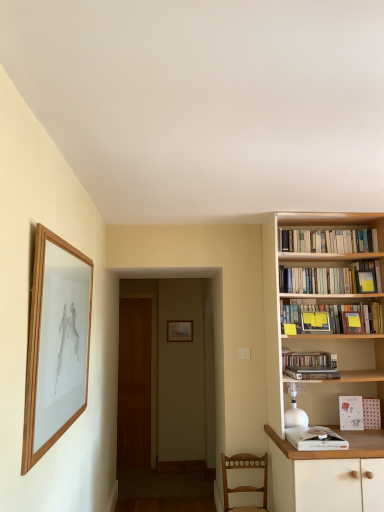
Image resolution: width=384 pixels, height=512 pixels. I want to click on wooden chair at lower right, so click(x=245, y=485).

Describe the element at coordinates (331, 279) in the screenshot. I see `hardcover books at upper right, which is counted as the second book, starting from the top` at that location.

Find the location of a particular element. brown wooden door at center is located at coordinates (134, 383).

From the picture: Is wooden bookshelf at right turned away from wooden chair at lower right?

wooden bookshelf at right does not have its back to wooden chair at lower right.

Considering the positions of objects wooden bookshelf at right and wooden chair at lower right in the image provided, who is more to the right, wooden bookshelf at right or wooden chair at lower right?

Positioned to the right is wooden bookshelf at right.

Would you say hardcover books at upper right, which is counted as the second book, starting from the top, is part of white paperbacks at upper right, the sixth book positioned from the bottom,'s contents?

No.

Considering the sizes of objects white paperbacks at upper right, which appears as the first book when viewed from the top, and hardcover books at upper right, which is counted as the second book, starting from the top, in the image provided, who is wider, white paperbacks at upper right, which appears as the first book when viewed from the top, or hardcover books at upper right, which is counted as the second book, starting from the top,?

hardcover books at upper right, which is counted as the second book, starting from the top.

Considering the positions of objects white paperbacks at upper right, the sixth book positioned from the bottom, and hardcover books at upper right, the 5th book in the bottom-to-top sequence, in the image provided, who is more to the right, white paperbacks at upper right, the sixth book positioned from the bottom, or hardcover books at upper right, the 5th book in the bottom-to-top sequence,?

white paperbacks at upper right, the sixth book positioned from the bottom.

Are white paperbacks at upper right, which appears as the first book when viewed from the top, and hardcover books at upper right, the 5th book in the bottom-to-top sequence, far apart?

Actually, white paperbacks at upper right, which appears as the first book when viewed from the top, and hardcover books at upper right, the 5th book in the bottom-to-top sequence, are a little close together.

Can you confirm if matte wooden picture frame at center, acting as the second picture frame starting from the front, is positioned to the right of wooden picture frame at left, which is counted as the first picture frame, starting from the front?

Yes.

From a real-world perspective, does matte wooden picture frame at center, acting as the second picture frame starting from the front, stand above wooden picture frame at left, acting as the second picture frame starting from the bottom?

No, from a real-world perspective, matte wooden picture frame at center, acting as the second picture frame starting from the front, is not over wooden picture frame at left, acting as the second picture frame starting from the bottom

Is matte wooden picture frame at center, which is the 2th picture frame in left-to-right order, oriented towards wooden picture frame at left, positioned as the first picture frame in top-to-bottom order?

Yes.

Is brown wooden door at center at the right side of matte wooden picture frame at center, acting as the second picture frame starting from the front?

Incorrect, brown wooden door at center is not on the right side of matte wooden picture frame at center, acting as the second picture frame starting from the front.

From the image's perspective, between brown wooden door at center and matte wooden picture frame at center, acting as the second picture frame starting from the front, which one is located above?

matte wooden picture frame at center, acting as the second picture frame starting from the front.

Which is less distant, (138, 415) or (186, 336)?

Positioned in front is point (138, 415).

From a real-world perspective, who is located higher, brown wooden door at center or matte wooden picture frame at center, placed as the 1th picture frame when sorted from back to front?

matte wooden picture frame at center, placed as the 1th picture frame when sorted from back to front, from a real-world perspective.

Can you tell me how much wooden chair at lower right and hardcover book at upper right, marked as the 3th book in a top-to-bottom arrangement, differ in facing direction?

0.0017 degrees separate the facing orientations of wooden chair at lower right and hardcover book at upper right, marked as the 3th book in a top-to-bottom arrangement.

Is wooden chair at lower right facing towards hardcover book at upper right, marked as the 3th book in a top-to-bottom arrangement?

No, wooden chair at lower right is not oriented towards hardcover book at upper right, marked as the 3th book in a top-to-bottom arrangement.

From the image's perspective, between wooden chair at lower right and hardcover book at upper right, which is the fourth book from bottom to top, which one is located above?

hardcover book at upper right, which is the fourth book from bottom to top, is shown above in the image.

Considering the relative positions of wooden chair at lower right and hardcover book at upper right, which is the fourth book from bottom to top, in the image provided, is wooden chair at lower right to the left of hardcover book at upper right, which is the fourth book from bottom to top, from the viewer's perspective?

Yes, wooden chair at lower right is to the left of hardcover book at upper right, which is the fourth book from bottom to top.

Is wooden picture frame at left, marked as the 2th picture frame in a right-to-left arrangement, looking in the opposite direction of wooden bookshelf at right?

No.

Is the depth of wooden picture frame at left, acting as the second picture frame starting from the bottom, greater than that of wooden bookshelf at right?

No, wooden picture frame at left, acting as the second picture frame starting from the bottom, is closer to the viewer.

From a real-world perspective, which is physically above, wooden picture frame at left, acting as the 2th picture frame starting from the back, or wooden bookshelf at right?

wooden bookshelf at right, from a real-world perspective.

How distant is wooden picture frame at left, acting as the second picture frame starting from the bottom, from wooden bookshelf at right?

A distance of 1.53 meters exists between wooden picture frame at left, acting as the second picture frame starting from the bottom, and wooden bookshelf at right.

Which object is thinner, hardcover books at upper right, which is counted as the second book, starting from the top, or white paper book at lower right, which is counted as the first book, starting from the bottom?

Thinner between the two is hardcover books at upper right, which is counted as the second book, starting from the top.

From the image's perspective, between hardcover books at upper right, which is counted as the second book, starting from the top, and white paper book at lower right, which is the sixth book in top-to-bottom order, who is located below?

white paper book at lower right, which is the sixth book in top-to-bottom order, from the image's perspective.

Between hardcover books at upper right, the 5th book in the bottom-to-top sequence, and white paper book at lower right, which is counted as the first book, starting from the bottom, which one appears on the right side from the viewer's perspective?

hardcover books at upper right, the 5th book in the bottom-to-top sequence, is more to the right.

Between point (326, 281) and point (317, 433), which one is positioned in front?

The point (317, 433) is closer.

You are a GUI agent. You are given a task and a screenshot of the screen. Output one action in this format:
    pyautogui.click(x=<x>, y=<y>)
    Task: Click on the chair located in front of the wooden bookshelf at right
    This screenshot has height=512, width=384.
    Given the screenshot: What is the action you would take?
    pyautogui.click(x=245, y=485)

Find the location of a particular element. The image size is (384, 512). the 2nd book to the left of the white paperbacks at upper right, the sixth book positioned from the bottom, starting your count from the anchor is located at coordinates (331, 279).

From the image, which object appears to be farther from white paperbacks at upper right, the sixth book positioned from the bottom, wooden bookshelf at right or white paper book at lower right, which is counted as the first book, starting from the bottom?

Based on the image, white paper book at lower right, which is counted as the first book, starting from the bottom, appears to be further to white paperbacks at upper right, the sixth book positioned from the bottom.

From the image, which object appears to be farther from wooden picture frame at left, the first picture frame in the left-to-right sequence, hardcover books at upper right, which is counted as the second book, starting from the top, or brown wooden door at center?

brown wooden door at center lies further to wooden picture frame at left, the first picture frame in the left-to-right sequence, than the other object.

When comparing their distances from white paperbacks at upper right, the sixth book positioned from the bottom, does wooden chair at lower right or matte wooden picture frame at center, the second picture frame from the top, seem closer?

wooden chair at lower right.

When comparing their distances from wooden picture frame at left, positioned as the first picture frame in top-to-bottom order, does hardcover books at right, positioned as the 4th book in top-to-bottom order, or hardcover books at upper right, the 5th book in the bottom-to-top sequence, seem closer?

hardcover books at right, positioned as the 4th book in top-to-bottom order, is closer to wooden picture frame at left, positioned as the first picture frame in top-to-bottom order.

From the picture: From the image, which object appears to be farther from wooden picture frame at left, positioned as the first picture frame in top-to-bottom order, hardcover book at upper right, which is the fourth book from bottom to top, or wooden bookshelf at right?

hardcover book at upper right, which is the fourth book from bottom to top, is positioned further to the anchor wooden picture frame at left, positioned as the first picture frame in top-to-bottom order.

From the image, which object appears to be nearer to hardcover books at upper right, which is counted as the second book, starting from the top, white glossy lamp at right or white paper book at lower right, which is counted as the first book, starting from the bottom?

white glossy lamp at right is positioned closer to the anchor hardcover books at upper right, which is counted as the second book, starting from the top.

Based on their spatial positions, is white glossy lamp at right or wooden picture frame at left, acting as the 2th picture frame starting from the back, closer to matte wooden picture frame at center, placed as the 1th picture frame when sorted from back to front?

white glossy lamp at right.

Looking at the image, which one is located closer to white paper card at right, the second book positioned from the bottom, wooden chair at lower right or wooden bookshelf at right?

Based on the image, wooden bookshelf at right appears to be nearer to white paper card at right, the second book positioned from the bottom.

You are a GUI agent. You are given a task and a screenshot of the screen. Output one action in this format:
    pyautogui.click(x=<x>, y=<y>)
    Task: Click on the lamp that lies between hardcover books at right, acting as the 3th book starting from the bottom, and wooden chair at lower right from top to bottom
    The height and width of the screenshot is (512, 384).
    Given the screenshot: What is the action you would take?
    pyautogui.click(x=295, y=412)

Locate an element on the screen. The image size is (384, 512). chair between wooden picture frame at left, positioned as the first picture frame in top-to-bottom order, and hardcover books at right, acting as the 3th book starting from the bottom, in the front-back direction is located at coordinates 245,485.

Locate an element on the screen. This screenshot has width=384, height=512. glass door between white paperbacks at upper right, the sixth book positioned from the bottom, and matte wooden picture frame at center, placed as the 1th picture frame when sorted from right to left, in the front-back direction is located at coordinates (134, 383).

This screenshot has height=512, width=384. I want to click on book between hardcover books at upper right, which is counted as the second book, starting from the top, and hardcover books at right, positioned as the 4th book in top-to-bottom order, in the vertical direction, so click(332, 317).